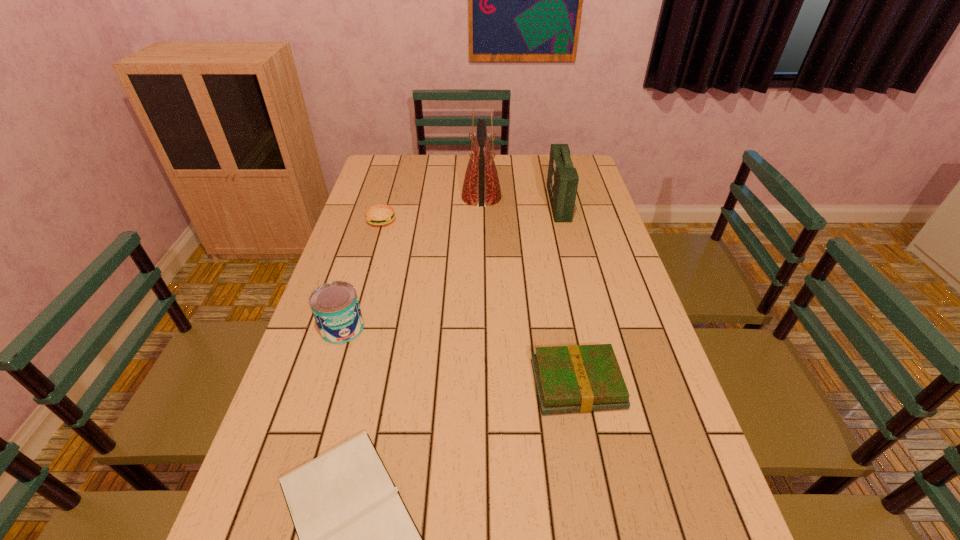
Find the location of a particular element. free spot located on the front-facing side of the fifth shortest object is located at coordinates (512, 203).

Where is `free point located 0.240m on the right of the third tallest object`? The image size is (960, 540). free point located 0.240m on the right of the third tallest object is located at coordinates (455, 328).

You are a GUI agent. You are given a task and a screenshot of the screen. Output one action in this format:
    pyautogui.click(x=<x>, y=<y>)
    Task: Click on the vacant space located on the back of the book
    The image size is (960, 540).
    Given the screenshot: What is the action you would take?
    pyautogui.click(x=566, y=330)

Identify the location of vacant space located on the front of the patty. [364, 281].

Identify the location of object present at the far edge. (481, 187).

This screenshot has width=960, height=540. What are the coordinates of `can positioned at the left edge` in the screenshot? It's located at (335, 306).

The height and width of the screenshot is (540, 960). I want to click on patty positioned at the left edge, so click(x=380, y=214).

In order to click on the first-aid kit that is at the right edge in this screenshot , I will do `click(562, 180)`.

Where is `book present at the right edge`? This screenshot has height=540, width=960. book present at the right edge is located at coordinates (575, 378).

This screenshot has width=960, height=540. In order to click on vacant position at the far edge of the desktop in this screenshot , I will do `click(424, 159)`.